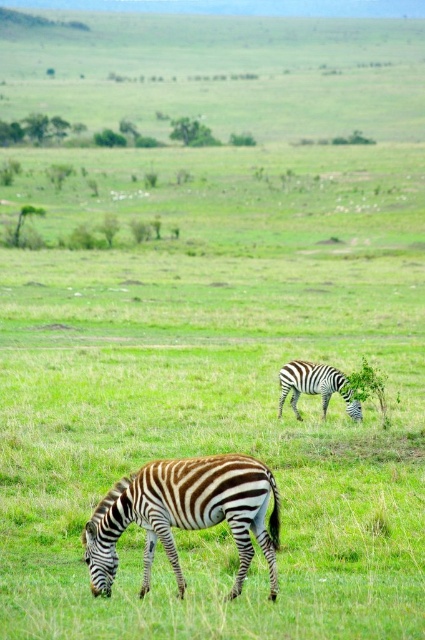
You are a wildlife photographer standing in the savanna. You want to capture a closeup shot of the brown and white striped zebra at lower center. Your telephoto lens can focus on subjects between 5 and 10 meters away. Can you take the photo without moving?

The brown and white striped zebra at lower center is 7.01 meters away from camera. Since the distance is within the telephoto lens range of 5 to 10 meters, you can take the photo without moving.

Looking at this image, you are a wildlife photographer aiming to capture both zebras in a single frame. Given that your camera can only focus on objects within a 3 meter width, will the brown and white striped zebra at lower center and the black and white striped zebra at center fit within this constraint?

The brown and white striped zebra at lower center is wider than the black and white striped zebra at center. Since the camera can focus on objects within a 3 meter width, both zebras must be positioned within this limit. However, without knowing their exact combined width, it is impossible to determine if they will fit. Please ensure their total width does not exceed 3 meters.

You are a photographer standing in the savanna and want to take a photo of the brown and white striped zebra at lower center. You notice that your camera has a focus point at position point (184, 515). Should you adjust the focus point to capture the zebra clearly?

The brown and white striped zebra at lower center is located at point (184, 515), so the focus point is already correctly positioned there. No adjustment is needed.